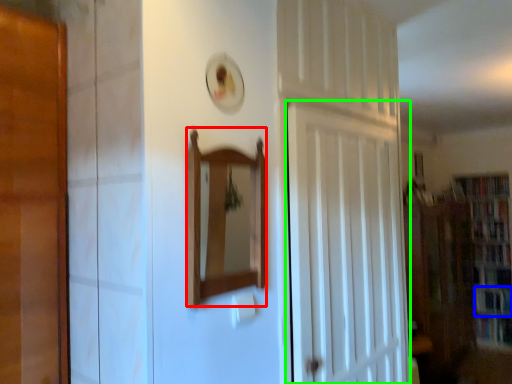
Question: Which object is the closest to the mirror (highlighted by a red box)? Choose among these: book (highlighted by a blue box) or door (highlighted by a green box).

Choices:
 (A) book
 (B) door

Answer: (B)